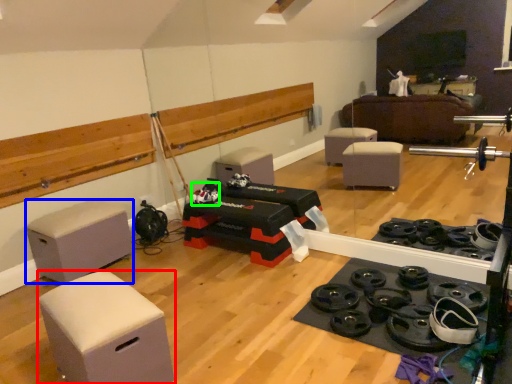
Question: Considering the real-world distances, which object is closest to furniture (highlighted by a red box)? furniture (highlighted by a blue box) or toy (highlighted by a green box).

Choices:
 (A) furniture
 (B) toy

Answer: (A)